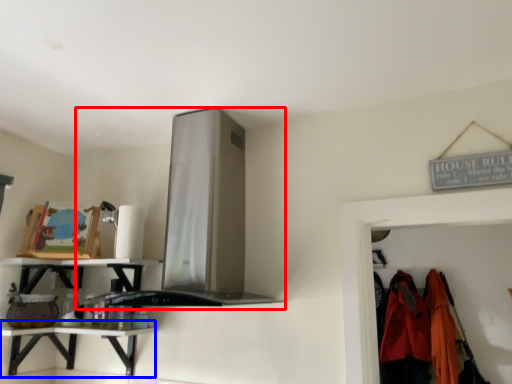
Question: Which object is further to the camera taking this photo, exhaust hood (highlighted by a red box) or counter (highlighted by a blue box)?

Choices:
 (A) exhaust hood
 (B) counter

Answer: (B)